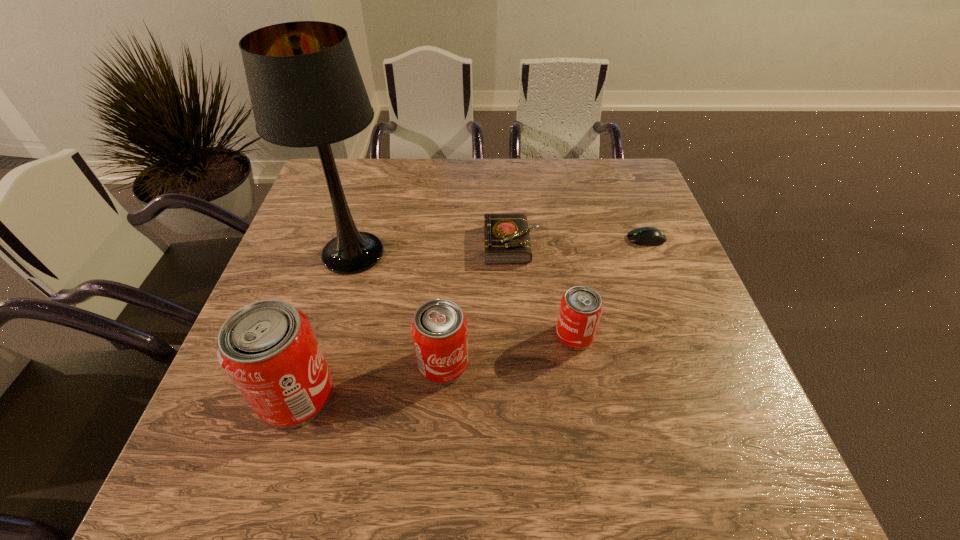
Where is `vacant space located on the right of the second tallest object`? vacant space located on the right of the second tallest object is located at coordinates (489, 395).

At what (x,y) coordinates should I click in order to perform the action: click on free spot located 0.050m on the left of the third tallest object. Please return your answer as a coordinate pair (x, y). The image size is (960, 540). Looking at the image, I should click on (394, 363).

Image resolution: width=960 pixels, height=540 pixels. I want to click on free space located on the back of the shortest can, so click(x=562, y=264).

Where is `vacant point located on the wheel side of the rightmost object`? This screenshot has height=540, width=960. vacant point located on the wheel side of the rightmost object is located at coordinates (514, 239).

I want to click on free region located on the wheel side of the rightmost object, so click(574, 239).

Locate an element on the screen. Image resolution: width=960 pixels, height=540 pixels. vacant space situated 0.170m on the wheel side of the rightmost object is located at coordinates click(x=563, y=239).

Identify the location of blank space located on the back of the table lamp. (379, 165).

Locate an element on the screen. vacant space located 0.300m on the back of the fifth tallest object is located at coordinates (508, 167).

I want to click on can present at the left edge, so click(268, 348).

Identify the location of table lamp located in the left edge section of the desktop. This screenshot has height=540, width=960. (306, 90).